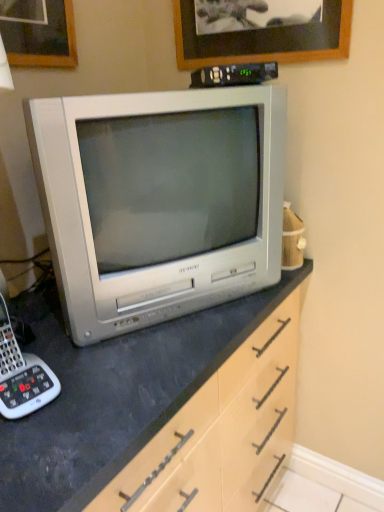
Where is `white plastic corded phone at lower left`? white plastic corded phone at lower left is located at coordinates (22, 375).

Consider the image. In order to face wooden picture frame at upper center, should I rotate leftwards or rightwards?

You should rotate right by 8.576 degrees.

Image resolution: width=384 pixels, height=512 pixels. Identify the location of wooden picture frame at upper center. (260, 31).

This screenshot has height=512, width=384. Describe the element at coordinates (234, 75) in the screenshot. I see `black plastic remote control at upper center` at that location.

This screenshot has height=512, width=384. I want to click on black plastic remote control at upper center, so click(234, 75).

At what (x,y) coordinates should I click in order to perform the action: click on silver metallic television at center. Please return your answer as a coordinate pair (x, y). This screenshot has width=384, height=512. Looking at the image, I should click on (158, 201).

Measure the distance between silver metallic television at center and camera.

silver metallic television at center is 29.50 inches away from camera.

Locate an element on the screen. This screenshot has height=512, width=384. white plastic corded phone at lower left is located at coordinates (22, 375).

Visually, is black plastic remote control at upper center positioned to the left or to the right of wooden picture frame at upper center?

black plastic remote control at upper center is positioned on wooden picture frame at upper center's left side.

From a real-world perspective, relative to wooden picture frame at upper center, is black plastic remote control at upper center vertically above or below?

Clearly, from a real-world perspective, black plastic remote control at upper center is below wooden picture frame at upper center.

Is black plastic remote control at upper center spatially inside wooden picture frame at upper center, or outside of it?

black plastic remote control at upper center is not inside wooden picture frame at upper center, it's outside.

Which of these two, silver metallic television at center or white plastic corded phone at lower left, is thinner?

Thinner between the two is white plastic corded phone at lower left.

Identify the location of corded phone on the left of silver metallic television at center. (22, 375).

Is silver metallic television at center facing away from white plastic corded phone at lower left?

silver metallic television at center does not have its back to white plastic corded phone at lower left.

Is silver metallic television at center far from white plastic corded phone at lower left?

No, silver metallic television at center is in close proximity to white plastic corded phone at lower left.

Considering the relative sizes of black plastic remote control at upper center and silver metallic television at center in the image provided, is black plastic remote control at upper center shorter than silver metallic television at center?

Yes.

Between point (226, 68) and point (268, 137), which one is positioned in front?

The point (226, 68) is closer to the camera.

In the image, there is a black plastic remote control at upper center. At what (x,y) coordinates should I click in order to perform the action: click on television below it (from the image's perspective). Please return your answer as a coordinate pair (x, y). This screenshot has height=512, width=384. Looking at the image, I should click on (158, 201).

Considering the relative positions of black plastic remote control at upper center and silver metallic television at center in the image provided, is black plastic remote control at upper center in front of silver metallic television at center?

That is False.

Does wooden picture frame at upper center appear on the right side of white plastic corded phone at lower left?

Yes, wooden picture frame at upper center is to the right of white plastic corded phone at lower left.

From a real-world perspective, is wooden picture frame at upper center positioned over white plastic corded phone at lower left based on gravity?

Yes, from a real-world perspective, wooden picture frame at upper center is above white plastic corded phone at lower left.

Is wooden picture frame at upper center oriented away from white plastic corded phone at lower left?

No, wooden picture frame at upper center's orientation is not away from white plastic corded phone at lower left.

Considering the relative positions of wooden picture frame at upper center and white plastic corded phone at lower left in the image provided, is wooden picture frame at upper center in front of white plastic corded phone at lower left?

No.

How many degrees apart are the facing directions of white plastic corded phone at lower left and silver metallic television at center?

The angle between the facing direction of white plastic corded phone at lower left and the facing direction of silver metallic television at center is 13.5 degrees.

Is white plastic corded phone at lower left inside the boundaries of silver metallic television at center, or outside?

white plastic corded phone at lower left cannot be found inside silver metallic television at center.

Which object is thinner, white plastic corded phone at lower left or silver metallic television at center?

white plastic corded phone at lower left.

Is white plastic corded phone at lower left positioned in front of silver metallic television at center?

Yes, white plastic corded phone at lower left is closer to the viewer.

How many degrees apart are the facing directions of white plastic corded phone at lower left and black plastic remote control at upper center?

13.8 degrees separate the facing orientations of white plastic corded phone at lower left and black plastic remote control at upper center.

Can you confirm if white plastic corded phone at lower left is thinner than black plastic remote control at upper center?

No.

Is there a large distance between white plastic corded phone at lower left and black plastic remote control at upper center?

No, there isn't a large distance between white plastic corded phone at lower left and black plastic remote control at upper center.

Considering the sizes of silver metallic television at center and black plastic remote control at upper center in the image, is silver metallic television at center bigger or smaller than black plastic remote control at upper center?

silver metallic television at center is bigger than black plastic remote control at upper center.

How much distance is there between silver metallic television at center and black plastic remote control at upper center?

A distance of 11.24 inches exists between silver metallic television at center and black plastic remote control at upper center.

Consider the image. From the image's perspective, is silver metallic television at center over black plastic remote control at upper center?

No.

Is silver metallic television at center far away from black plastic remote control at upper center?

silver metallic television at center is actually quite close to black plastic remote control at upper center.

The image size is (384, 512). I want to click on picture frame above the black plastic remote control at upper center (from a real-world perspective), so click(260, 31).

Where is `corded phone below the silver metallic television at center (from a real-world perspective)`? This screenshot has height=512, width=384. corded phone below the silver metallic television at center (from a real-world perspective) is located at coordinates (22, 375).

Based on their spatial positions, is silver metallic television at center or wooden picture frame at upper center closer to black plastic remote control at upper center?

Among the two, wooden picture frame at upper center is located nearer to black plastic remote control at upper center.

In the scene shown: Which object lies further to the anchor point silver metallic television at center, white plastic corded phone at lower left or black plastic remote control at upper center?

The object further to silver metallic television at center is white plastic corded phone at lower left.

Consider the image. Estimate the real-world distances between objects in this image. Which object is further from white plastic corded phone at lower left, silver metallic television at center or wooden picture frame at upper center?

Among the two, wooden picture frame at upper center is located further to white plastic corded phone at lower left.

Considering their positions, is black plastic remote control at upper center positioned closer to wooden picture frame at upper center than white plastic corded phone at lower left?

black plastic remote control at upper center.

From the image, which object appears to be farther from black plastic remote control at upper center, white plastic corded phone at lower left or silver metallic television at center?

white plastic corded phone at lower left is further to black plastic remote control at upper center.

Looking at the image, which one is located further to white plastic corded phone at lower left, black plastic remote control at upper center or wooden picture frame at upper center?

wooden picture frame at upper center is further to white plastic corded phone at lower left.

Looking at this image, based on their spatial positions, is wooden picture frame at upper center or silver metallic television at center further from white plastic corded phone at lower left?

Based on the image, wooden picture frame at upper center appears to be further to white plastic corded phone at lower left.

Estimate the real-world distances between objects in this image. Which object is further from black plastic remote control at upper center, wooden picture frame at upper center or white plastic corded phone at lower left?

The object further to black plastic remote control at upper center is white plastic corded phone at lower left.

Image resolution: width=384 pixels, height=512 pixels. Find the location of `appliance between wooden picture frame at upper center and silver metallic television at center vertically`. appliance between wooden picture frame at upper center and silver metallic television at center vertically is located at coordinates coord(234,75).

You are a GUI agent. You are given a task and a screenshot of the screen. Output one action in this format:
    pyautogui.click(x=<x>, y=<y>)
    Task: Click on the appliance between wooden picture frame at upper center and white plastic corded phone at lower left vertically
    
    Given the screenshot: What is the action you would take?
    pyautogui.click(x=234, y=75)

In order to click on television between black plastic remote control at upper center and white plastic corded phone at lower left in the up-down direction in this screenshot , I will do `click(158, 201)`.

Locate an element on the screen. This screenshot has width=384, height=512. television between wooden picture frame at upper center and white plastic corded phone at lower left vertically is located at coordinates (158, 201).